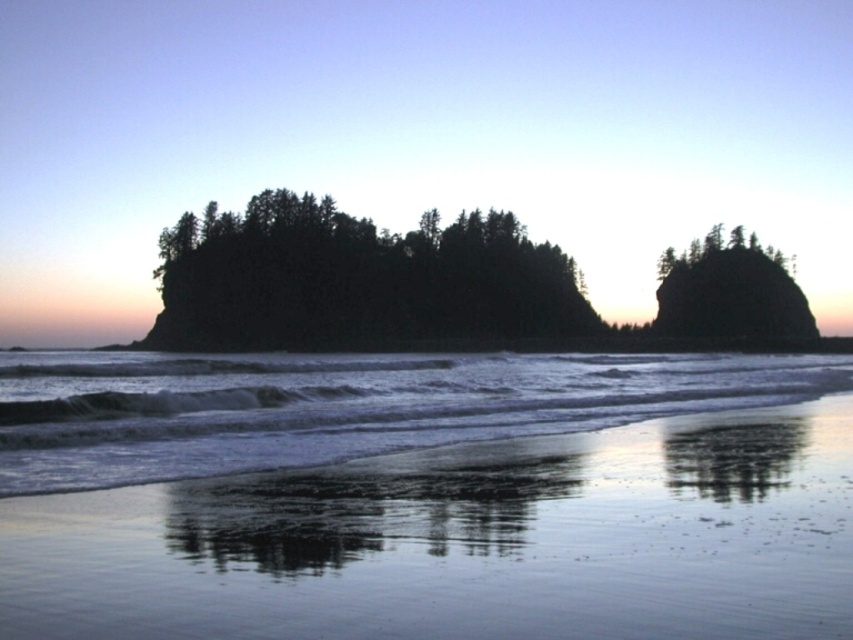
You are standing on the beach and see the clear water at lower center and the dark green forest at center. Which object is located to the left when facing the scene?

The clear water at lower center is positioned on the left side of dark green forest at center, so it is located to the left when facing the scene.

You are standing on the beach and want to take a photo of both the clear water at lower center and the dark green forest at center. Since the forest is part of the background, will you need to adjust your camera focus to capture both clearly?

The clear water at lower center is in front of the dark green forest at center, so adjusting the focus to the clear water at lower center will ensure both are in focus as they are in the same focal plane.